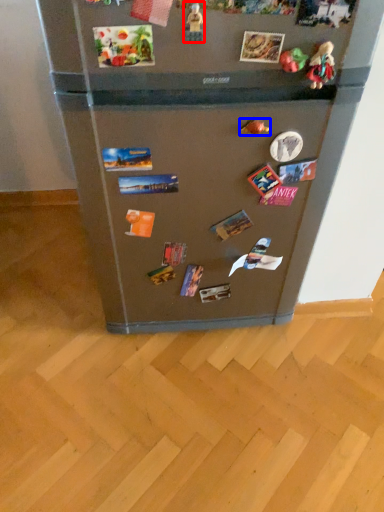
Question: Which object appears farthest to the camera in this image, toy (highlighted by a red box) or toy (highlighted by a blue box)?

Choices:
 (A) toy
 (B) toy

Answer: (B)